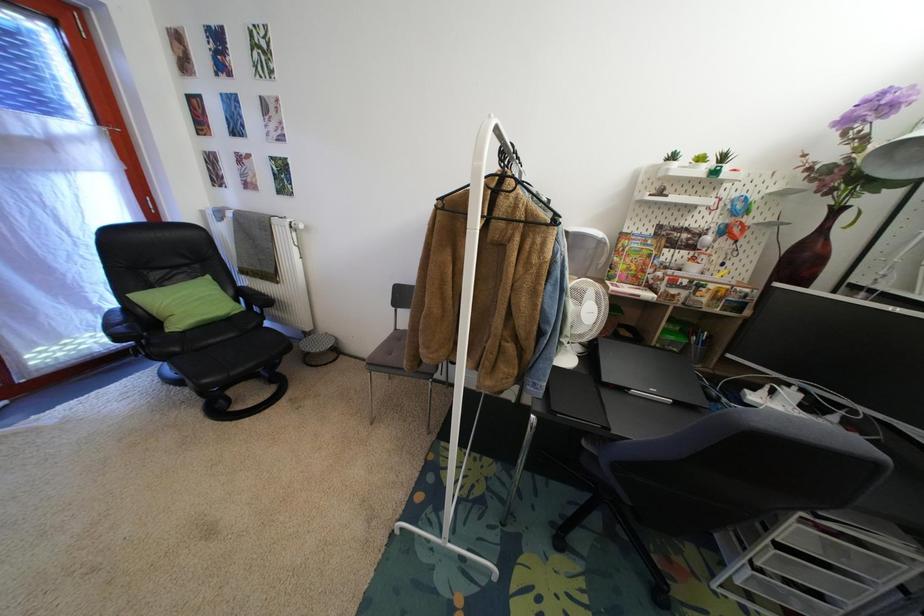
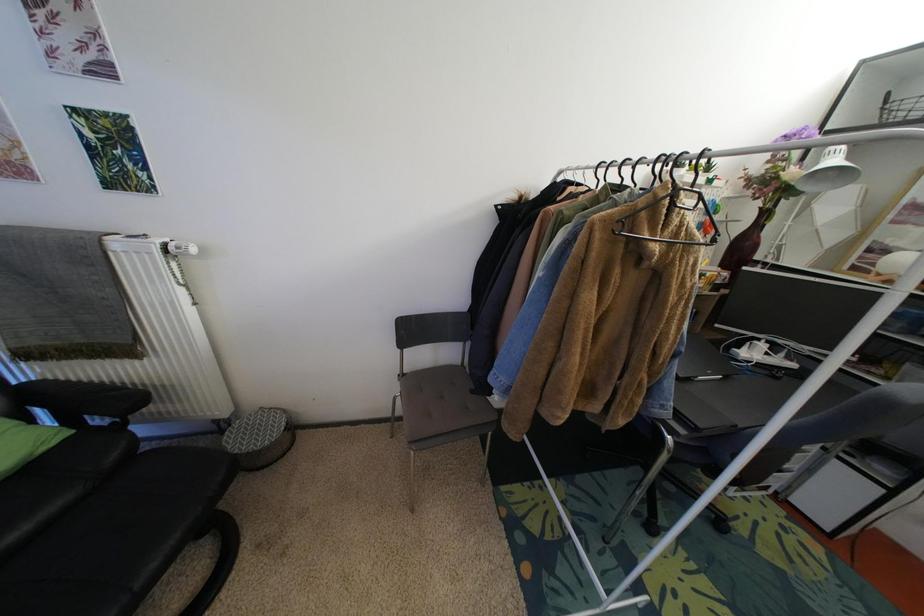
The images are taken continuously from a first-person perspective. In which direction are you moving?

The cameraman moved toward left, forward.